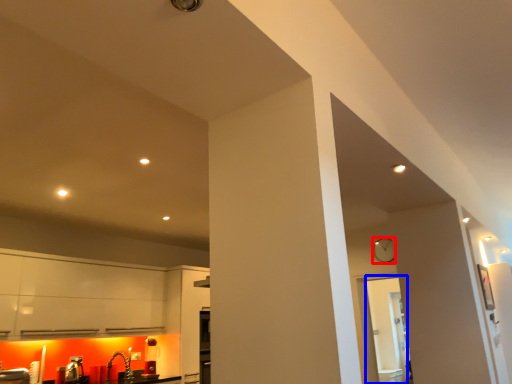
Question: Which point is closer to the camera, clock (highlighted by a red box) or glass door (highlighted by a blue box)?

Choices:
 (A) clock
 (B) glass door

Answer: (B)